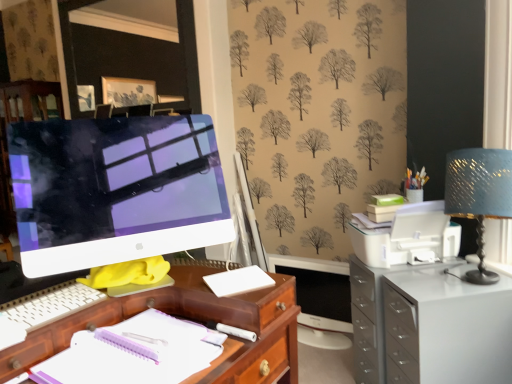
The image size is (512, 384). Describe the element at coordinates (134, 353) in the screenshot. I see `white paper notebook at center` at that location.

What are the coordinates of `white glossy computer monitor at left` in the screenshot? It's located at (115, 190).

What do you see at coordinates (22, 120) in the screenshot? I see `white glossy computer monitor at left` at bounding box center [22, 120].

Identify the location of white matte cutting board at center. (238, 281).

Locate an element on the screen. This screenshot has height=384, width=512. white glossy filing cabinet at right is located at coordinates [x=429, y=327].

What do you see at coordinates (50, 304) in the screenshot? I see `white plastic keyboard at lower left` at bounding box center [50, 304].

Find the location of a particular element. white paper notebook at center is located at coordinates (134, 353).

Which object is closer to the camera, white glossy filing cabinet at right or white glossy computer monitor at left?

white glossy computer monitor at left is closer to the camera.

Is the surface of white glossy filing cabinet at right in direct contact with white glossy computer monitor at left?

No, white glossy filing cabinet at right is not in contact with white glossy computer monitor at left.

What's the angular difference between white glossy filing cabinet at right and white glossy computer monitor at left's facing directions?

white glossy filing cabinet at right and white glossy computer monitor at left are facing 115 degrees away from each other.

Which object is positioned more to the left, white glossy filing cabinet at right or white glossy computer monitor at left?

Positioned to the left is white glossy computer monitor at left.

Is white glossy computer monitor at left positioned with its back to white glossy filing cabinet at right?

No.

From a real-world perspective, between white glossy computer monitor at left and white glossy filing cabinet at right, who is vertically lower?

white glossy filing cabinet at right, from a real-world perspective.

Based on the photo, which is in front, white glossy computer monitor at left or white glossy filing cabinet at right?

white glossy filing cabinet at right is closer to the camera.

Can you confirm if white glossy computer monitor at left is wider than white glossy filing cabinet at right?

No.

From the image's perspective, is white glossy computer monitor at left located above white plastic keyboard at lower left?

Yes.

In the image, is white glossy computer monitor at left positioned in front of or behind white plastic keyboard at lower left?

Visually, white glossy computer monitor at left is located in front of white plastic keyboard at lower left.

From a real-world perspective, relative to white plastic keyboard at lower left, is white glossy computer monitor at left vertically above or below?

Clearly, from a real-world perspective, white glossy computer monitor at left is above white plastic keyboard at lower left.

Is white glossy computer monitor at left to the left or to the right of white plastic keyboard at lower left in the image?

white glossy computer monitor at left is positioned on white plastic keyboard at lower left's right side.

Which object is positioned more to the right, white glossy computer monitor at left or white plastic printer at right?

white plastic printer at right is more to the right.

From the image's perspective, would you say white glossy computer monitor at left is shown under white plastic printer at right?

No, from the image's perspective, white glossy computer monitor at left is not below white plastic printer at right.

Is white glossy computer monitor at left bigger or smaller than white plastic printer at right?

white glossy computer monitor at left is bigger than white plastic printer at right.

Considering the positions of points (0, 219) and (384, 264), is point (0, 219) closer to camera compared to point (384, 264)?

Yes.

Is white plastic printer at right with white glossy computer monitor at left?

white plastic printer at right is not next to white glossy computer monitor at left, and they're not touching.

Is white plastic printer at right not inside white glossy computer monitor at left?

white plastic printer at right lies outside white glossy computer monitor at left's area.

What's the angular difference between white plastic printer at right and white glossy computer monitor at left's facing directions?

There is a 50.6-degree angle between the facing directions of white plastic printer at right and white glossy computer monitor at left.

Based on the photo, can you confirm if white plastic printer at right is wider than white glossy computer monitor at left?

No, white plastic printer at right is not wider than white glossy computer monitor at left.

Is white plastic keyboard at lower left surrounding white matte cutting board at center?

No, white plastic keyboard at lower left does not contain white matte cutting board at center.

Considering the positions of objects white plastic keyboard at lower left and white matte cutting board at center in the image provided, who is more to the left, white plastic keyboard at lower left or white matte cutting board at center?

From the viewer's perspective, white plastic keyboard at lower left appears more on the left side.

How distant is white plastic keyboard at lower left from white matte cutting board at center?

white plastic keyboard at lower left is 15.01 inches from white matte cutting board at center.

Is white plastic keyboard at lower left thinner than white matte cutting board at center?

Incorrect, the width of white plastic keyboard at lower left is not less than that of white matte cutting board at center.

Which of these two, white glossy filing cabinet at right or white matte cutting board at center, is smaller?

white matte cutting board at center.

The image size is (512, 384). I want to click on office supplies in front of the white glossy filing cabinet at right, so click(238, 281).

From a real-world perspective, is white glossy filing cabinet at right physically above white matte cutting board at center?

No, from a real-world perspective, white glossy filing cabinet at right is not on top of white matte cutting board at center.

At what (x,y) coordinates should I click in order to perform the action: click on computer monitor positioned vertically above the white glossy filing cabinet at right (from a real-world perspective). Please return your answer as a coordinate pair (x, y). Looking at the image, I should click on (115, 190).

I want to click on dresser that appears above the white glossy filing cabinet at right (from the image's perspective), so click(22, 120).

Based on their spatial positions, is white plastic keyboard at lower left or white glossy filing cabinet at right closer to white paper notebook at center?

white plastic keyboard at lower left lies closer to white paper notebook at center than the other object.

Based on their spatial positions, is white glossy computer monitor at left or white plastic keyboard at lower left further from white matte cutting board at center?

Among the two, white glossy computer monitor at left is located further to white matte cutting board at center.

Considering their positions, is white matte cutting board at center positioned closer to white glossy computer monitor at left than white plastic printer at right?

Based on the image, white plastic printer at right appears to be nearer to white glossy computer monitor at left.

When comparing their distances from blue textured lampshade at upper right, does white matte cutting board at center or white glossy computer monitor at left seem closer?

Among the two, white matte cutting board at center is located nearer to blue textured lampshade at upper right.

Looking at the image, which one is located further to white glossy computer monitor at left, white matte cutting board at center or blue textured lampshade at upper right?

Among the two, blue textured lampshade at upper right is located further to white glossy computer monitor at left.

Which object lies nearer to the anchor point white glossy filing cabinet at right, white plastic printer at right or white paper notebook at center?

The object closer to white glossy filing cabinet at right is white plastic printer at right.

Considering their positions, is white plastic keyboard at lower left positioned closer to white glossy computer monitor at left than white matte cutting board at center?

white plastic keyboard at lower left is closer to white glossy computer monitor at left.

From the image, which object appears to be farther from white glossy computer monitor at left, blue textured lampshade at upper right or white glossy filing cabinet at right?

Based on the image, blue textured lampshade at upper right appears to be further to white glossy computer monitor at left.

The height and width of the screenshot is (384, 512). Identify the location of printer between blue textured lampshade at upper right and white glossy filing cabinet at right in the up-down direction. (408, 237).

Where is `printer positioned between white paper notebook at center and white glossy computer monitor at left from near to far`? The height and width of the screenshot is (384, 512). printer positioned between white paper notebook at center and white glossy computer monitor at left from near to far is located at coordinates (408, 237).

The image size is (512, 384). What are the coordinates of `notebook between white plastic keyboard at lower left and white plastic printer at right from left to right` in the screenshot? It's located at (134, 353).

Identify the location of printer located between white plastic keyboard at lower left and white glossy filing cabinet at right in the left-right direction. (408, 237).